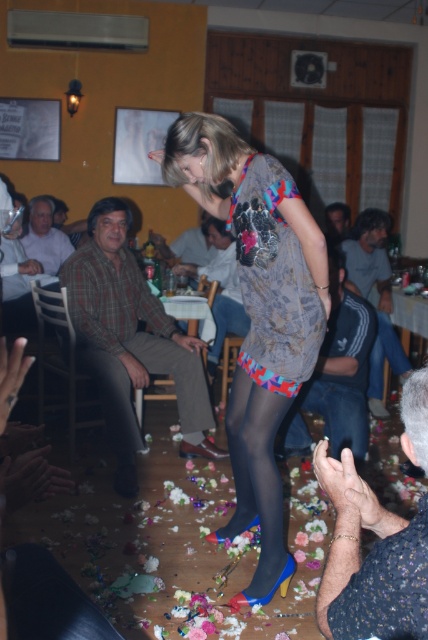
How much distance is there between dark gray adidas tracksuit at right and white shirt at left?

dark gray adidas tracksuit at right and white shirt at left are 7.86 feet apart.

The image size is (428, 640). What do you see at coordinates (379, 298) in the screenshot? I see `dark gray adidas tracksuit at right` at bounding box center [379, 298].

Between point (365, 241) and point (27, 241), which one is positioned in front?

Point (365, 241)

Identify the location of dark gray adidas tracksuit at right. (379, 298).

Which of these two, jeans at center or white shirt at left, stands shorter?

white shirt at left

Which is more to the left, jeans at center or white shirt at left?

From the viewer's perspective, white shirt at left appears more on the left side.

Find the location of a particular element. jeans at center is located at coordinates (336, 374).

Is smooth skin hands at lower right closer to camera compared to jeans at center?

Yes, smooth skin hands at lower right is in front of jeans at center.

Between smooth skin hands at lower right and jeans at center, which one is positioned higher?

jeans at center is higher up.

You are a GUI agent. You are given a task and a screenshot of the screen. Output one action in this format:
    pyautogui.click(x=<x>, y=<y>)
    Task: Click on the smooth skin hands at lower right
    The width and height of the screenshot is (428, 640).
    Given the screenshot: What is the action you would take?
    pyautogui.click(x=369, y=561)

You are a GUI agent. You are given a task and a screenshot of the screen. Output one action in this format:
    pyautogui.click(x=<x>, y=<y>)
    Task: Click on the smooth skin hands at lower right
    Image resolution: width=428 pixels, height=640 pixels.
    Given the screenshot: What is the action you would take?
    pyautogui.click(x=369, y=561)